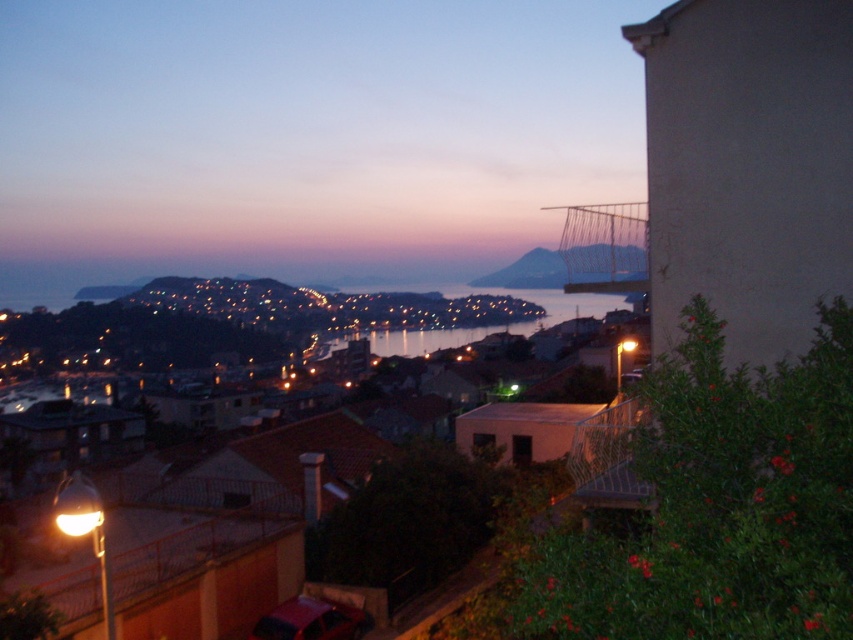
You are standing on a cliff overlooking the coastal town. You see the metallic silver balcony at lower right and the glistening water at center. Which object is positioned to the right side of the other?

The metallic silver balcony at lower right is to the right of glistening water at center.

You are standing in front of the coastal town scene. There are two points marked in the image. The first point is at coordinates point (431, 198) and the second is at point (625, 248). If you want to touch the nearest point to you, which one should you choose?

Point (431, 198) is further to the camera than point (625, 248), so the nearest point to you is point (625, 248).